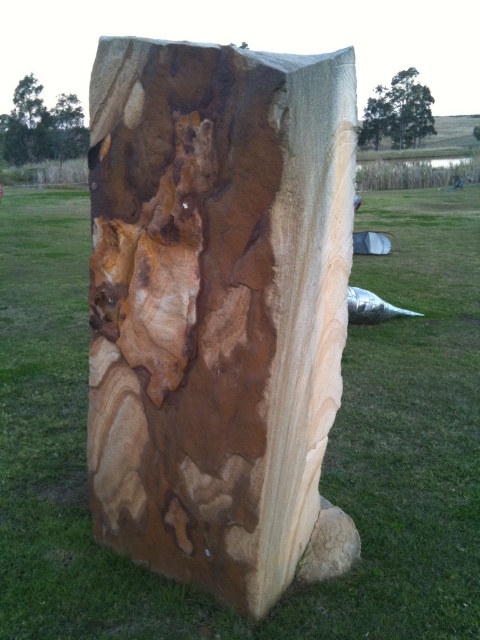
The image size is (480, 640). Describe the element at coordinates (216, 305) in the screenshot. I see `natural wood slab at center` at that location.

Between point (202, 483) and point (377, 125), which one is positioned in front?

Point (202, 483) is in front.

Does point (97, 380) come farther from viewer compared to point (360, 138)?

No.

Locate an element on the screen. natural wood slab at center is located at coordinates (216, 305).

This screenshot has height=640, width=480. What do you see at coordinates (324, 460) in the screenshot?
I see `green grass at center` at bounding box center [324, 460].

Locate an element on the screen. green grass at center is located at coordinates (324, 460).

You are a GUI agent. You are given a task and a screenshot of the screen. Output one action in this format:
    pyautogui.click(x=<x>, y=<y>)
    Task: Click on the green grass at center
    This screenshot has width=480, height=640.
    Given the screenshot: What is the action you would take?
    pyautogui.click(x=324, y=460)

Between green grass at center and brown wood tree at upper left, which one is positioned lower?

green grass at center is below.

What do you see at coordinates (324, 460) in the screenshot? I see `green grass at center` at bounding box center [324, 460].

Image resolution: width=480 pixels, height=640 pixels. In order to click on green grass at center in this screenshot , I will do `click(324, 460)`.